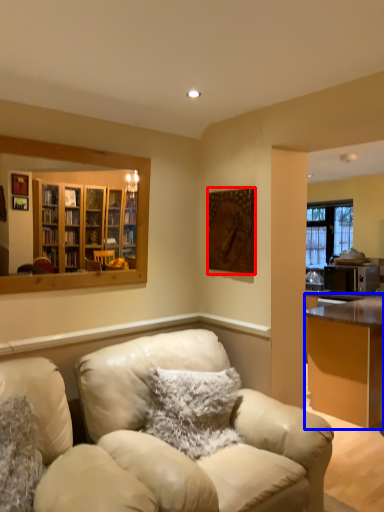
Question: Which of the following is the closest to the observer, picture frame (highlighted by a red box) or desk (highlighted by a blue box)?

Choices:
 (A) picture frame
 (B) desk

Answer: (A)